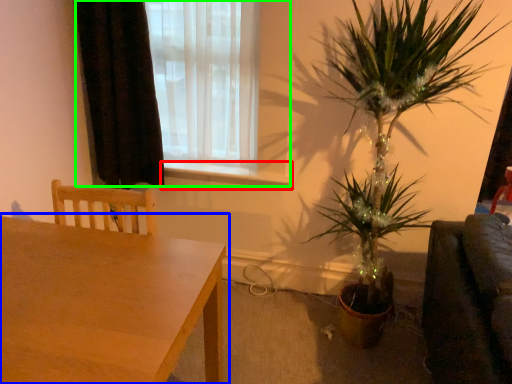
Question: Which is nearer to the window sill (highlighted by a red box)? table (highlighted by a blue box) or window (highlighted by a green box).

Choices:
 (A) table
 (B) window

Answer: (B)